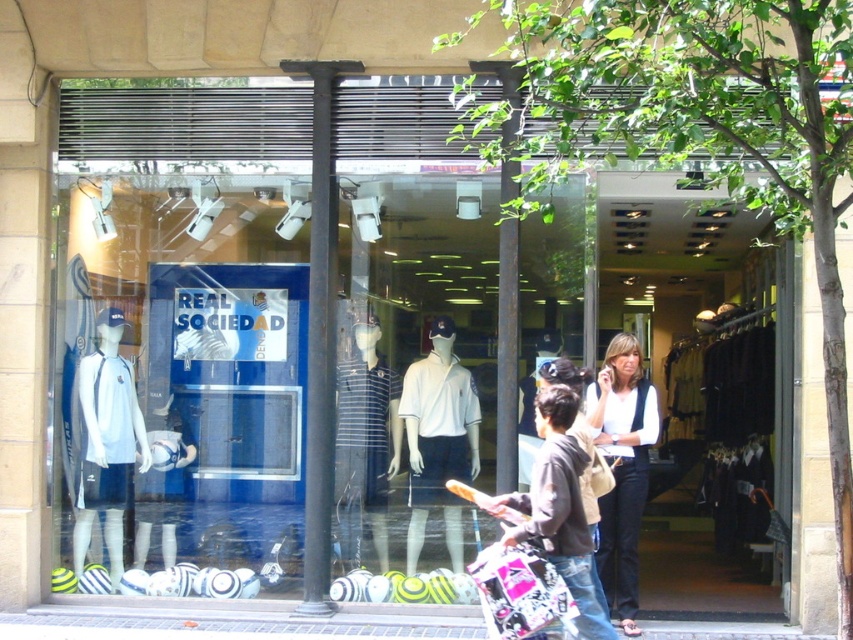
You are a customer browsing the store and want to pick up both the striped fabric polo shirt at center and the dark brown hoodie at center. Which item should you reach for first if you want to grab the higher one first?

The striped fabric polo shirt at center is located above the dark brown hoodie at center, so you should reach for the striped fabric polo shirt at center first.

You are a customer browsing the store and see the striped fabric polo shirt at center and the dark brown hoodie at center. Which one is positioned more to the left side?

The striped fabric polo shirt at center is positioned to the left of the dark brown hoodie at center, so it is more to the left side.